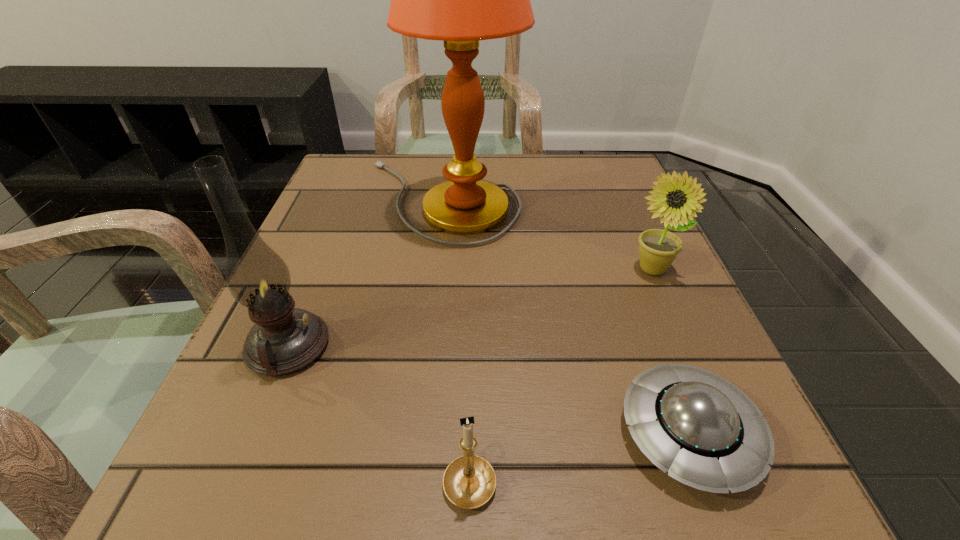
This screenshot has width=960, height=540. I want to click on the farthest object, so click(460, 0).

Locate an element on the screen. lamp is located at coordinates (460, 0).

Find the location of `the fourth shortest object`. the fourth shortest object is located at coordinates (284, 339).

This screenshot has width=960, height=540. Identify the location of sunflower. (658, 248).

The height and width of the screenshot is (540, 960). Find the location of `the second farthest object`. the second farthest object is located at coordinates (658, 248).

The image size is (960, 540). In order to click on candle holder in this screenshot , I will do `click(469, 481)`.

What are the coordinates of `the shortest object` in the screenshot? It's located at (704, 431).

Where is `vacant space located on the front of the tallest object`? vacant space located on the front of the tallest object is located at coordinates (423, 347).

Locate an element on the screen. This screenshot has width=960, height=540. free region located 0.060m on the front of the second tallest object is located at coordinates (257, 421).

Find the location of `vacant space situated 0.110m on the face of the third tallest object`. vacant space situated 0.110m on the face of the third tallest object is located at coordinates (679, 332).